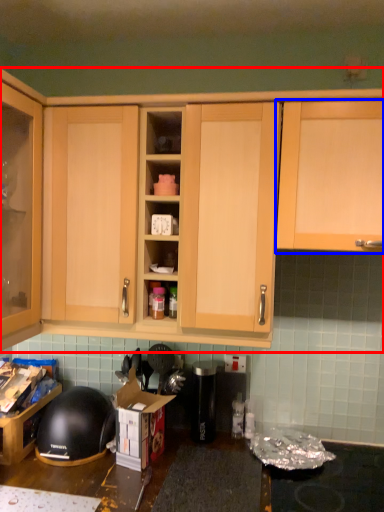
Question: Among these objects, which one is nearest to the camera, cabinetry (highlighted by a red box) or cabinetry (highlighted by a blue box)?

Choices:
 (A) cabinetry
 (B) cabinetry

Answer: (B)